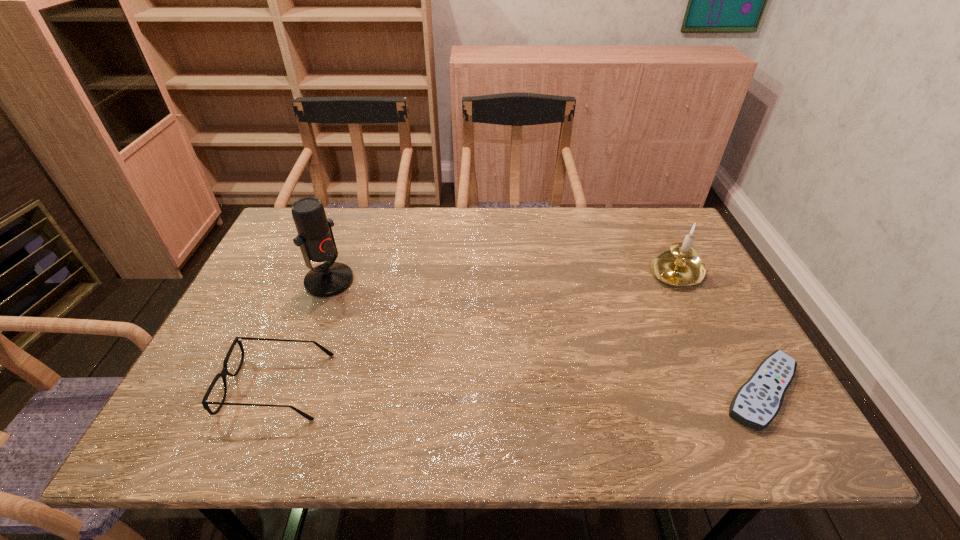
At what (x,y) coordinates should I click in order to perform the action: click on vacant space at the far edge. Please return your answer as a coordinate pair (x, y). The width and height of the screenshot is (960, 540). Looking at the image, I should click on (427, 214).

I want to click on free spot at the near edge of the desktop, so click(x=335, y=395).

Where is `vacant space at the left edge`? The height and width of the screenshot is (540, 960). vacant space at the left edge is located at coordinates (260, 282).

Identify the location of vacant space at the right edge of the desktop. (694, 314).

The height and width of the screenshot is (540, 960). I want to click on vacant area at the far right corner, so click(626, 214).

Identify the location of vacant space that is in between the spectacles and the remote control. The width and height of the screenshot is (960, 540). (519, 389).

Identify the location of free area in between the microphone and the remote control. (545, 336).

In order to click on free space between the remote control and the spectacles in this screenshot , I will do `click(519, 389)`.

The image size is (960, 540). I want to click on vacant space that is in between the tallest object and the candle holder, so click(x=502, y=276).

Where is `vacant space that is in between the microphone and the shortest object`? This screenshot has width=960, height=540. vacant space that is in between the microphone and the shortest object is located at coordinates (545, 336).